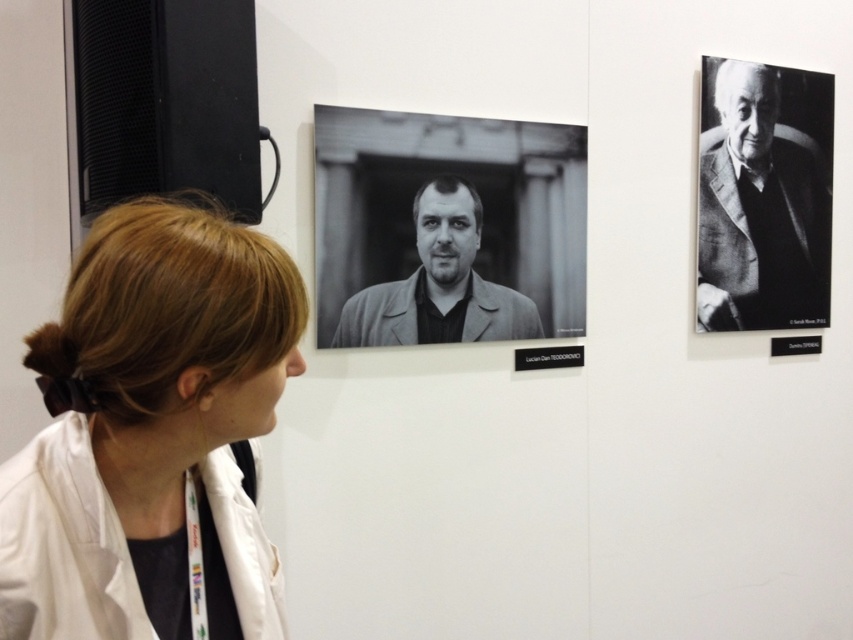
Can you confirm if black textured suit at upper right is thinner than black matte jacket at center?

Yes, black textured suit at upper right is thinner than black matte jacket at center.

Who is shorter, black textured suit at upper right or black matte jacket at center?

With less height is black matte jacket at center.

Between point (753, 232) and point (358, 294), which one is positioned in front?

Point (358, 294)

Locate an element on the screen. black textured suit at upper right is located at coordinates (763, 196).

Which is more to the left, blonde hair at center or black textured suit at upper right?

blonde hair at center

Between point (125, 369) and point (772, 310), which one is positioned in front?

Point (125, 369)

At what (x,y) coordinates should I click in order to perform the action: click on blonde hair at center. Please return your answer as a coordinate pair (x, y). This screenshot has width=853, height=640. Looking at the image, I should click on (154, 435).

Which is more to the left, blonde hair at center or black matte jacket at center?

From the viewer's perspective, blonde hair at center appears more on the left side.

Is point (103, 502) positioned behind point (540, 330)?

No, (103, 502) is in front of (540, 330).

Locate an element on the screen. This screenshot has height=640, width=853. blonde hair at center is located at coordinates (154, 435).